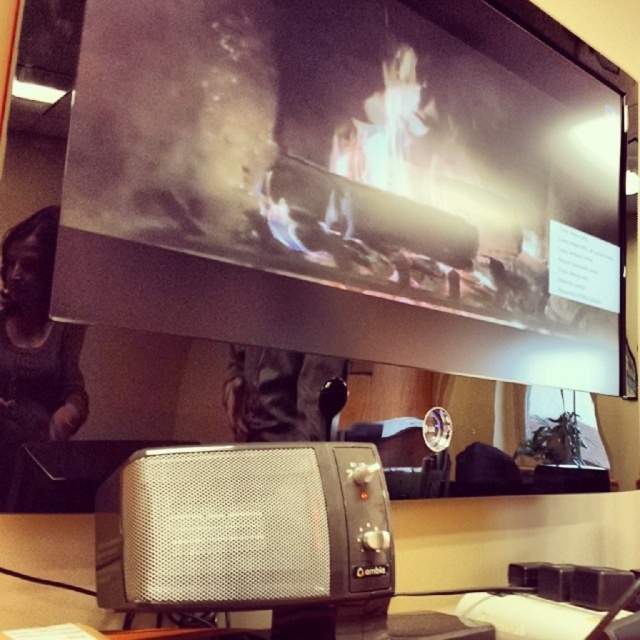
Question: Which object is closer to the camera taking this photo?

Choices:
 (A) silver mesh speaker at center
 (B) metallic glass fireplace at upper center

Answer: (A)

Question: Does metallic glass fireplace at upper center have a larger size compared to silver mesh speaker at center?

Choices:
 (A) yes
 (B) no

Answer: (A)

Question: Which object is closer to the camera taking this photo?

Choices:
 (A) metallic glass fireplace at upper center
 (B) silver mesh speaker at center

Answer: (B)

Question: Does metallic glass fireplace at upper center appear on the right side of silver mesh speaker at center?

Choices:
 (A) no
 (B) yes

Answer: (B)

Question: Can you confirm if metallic glass fireplace at upper center is positioned to the left of silver mesh speaker at center?

Choices:
 (A) yes
 (B) no

Answer: (B)

Question: Which of the following is the closest to the observer?

Choices:
 (A) silver mesh speaker at center
 (B) metallic glass fireplace at upper center

Answer: (A)